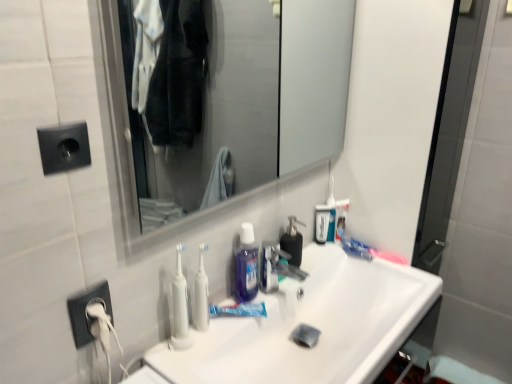
Identify the location of free location in front of transparent plastic mouthwash at center, the 3th mouthwash positioned from the front. The image size is (512, 384). (317, 258).